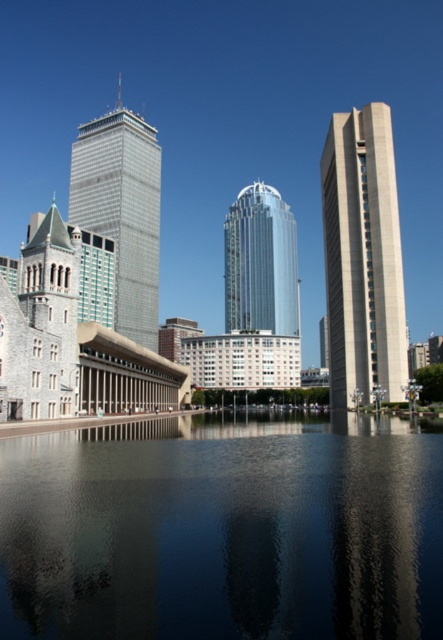
Is black reflective water at center above metallic glass skyscraper at center?

Actually, black reflective water at center is below metallic glass skyscraper at center.

Is point (190, 420) positioned after point (120, 145)?

No, (190, 420) is closer to viewer.

Does point (354, 422) come in front of point (123, 220)?

Yes, point (354, 422) is closer to viewer.

The image size is (443, 640). What are the coordinates of `black reflective water at center` in the screenshot? It's located at (224, 531).

Measure the distance between black reflective water at center and beige concrete tower at right.

A distance of 50.13 meters exists between black reflective water at center and beige concrete tower at right.

What do you see at coordinates (224, 531) in the screenshot? The width and height of the screenshot is (443, 640). I see `black reflective water at center` at bounding box center [224, 531].

Where is `black reflective water at center`? This screenshot has width=443, height=640. black reflective water at center is located at coordinates (224, 531).

How far apart are beige concrete tower at right and metallic glass skyscraper at center?

beige concrete tower at right is 197.28 feet from metallic glass skyscraper at center.

Does point (345, 404) lie in front of point (108, 208)?

Yes.

Where is `beige concrete tower at right`? beige concrete tower at right is located at coordinates (362, 259).